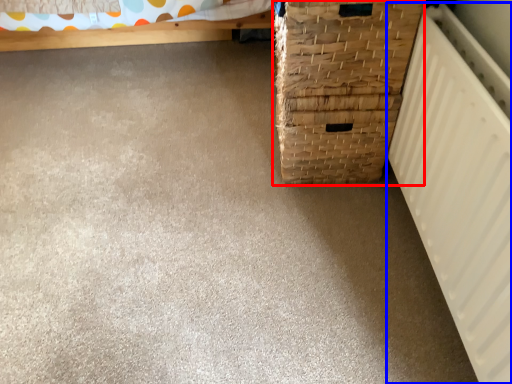
Question: Which object is further to the camera taking this photo, basket container (highlighted by a red box) or radiator (highlighted by a blue box)?

Choices:
 (A) basket container
 (B) radiator

Answer: (A)